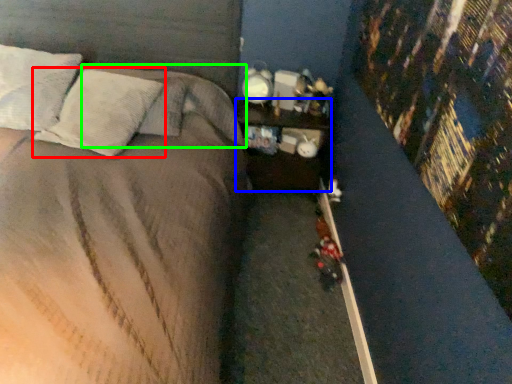
Question: Which object is the farthest from pillow (highlighted by a red box)? Choose among these: nightstand (highlighted by a blue box) or pillow (highlighted by a green box).

Choices:
 (A) nightstand
 (B) pillow

Answer: (A)